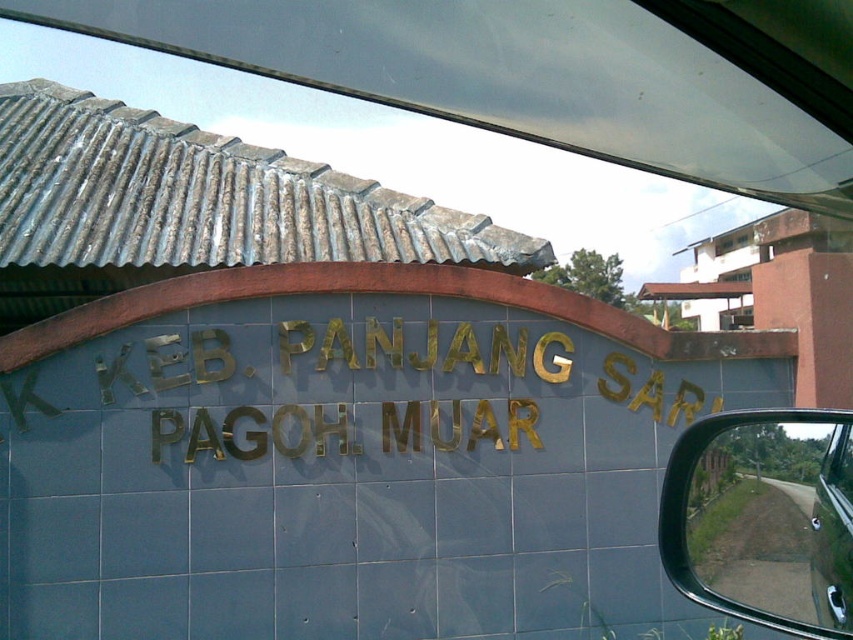
Where is the gold metallic sign at center located in the image?

The gold metallic sign at center is located at point (427, 349) in the image.